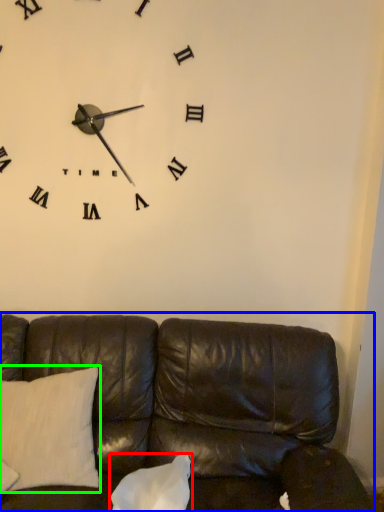
Question: Estimate the real-world distances between objects in this image. Which object is closer to pillow (highlighted by a red box), studio couch (highlighted by a blue box) or pillow (highlighted by a green box)?

Choices:
 (A) studio couch
 (B) pillow

Answer: (A)